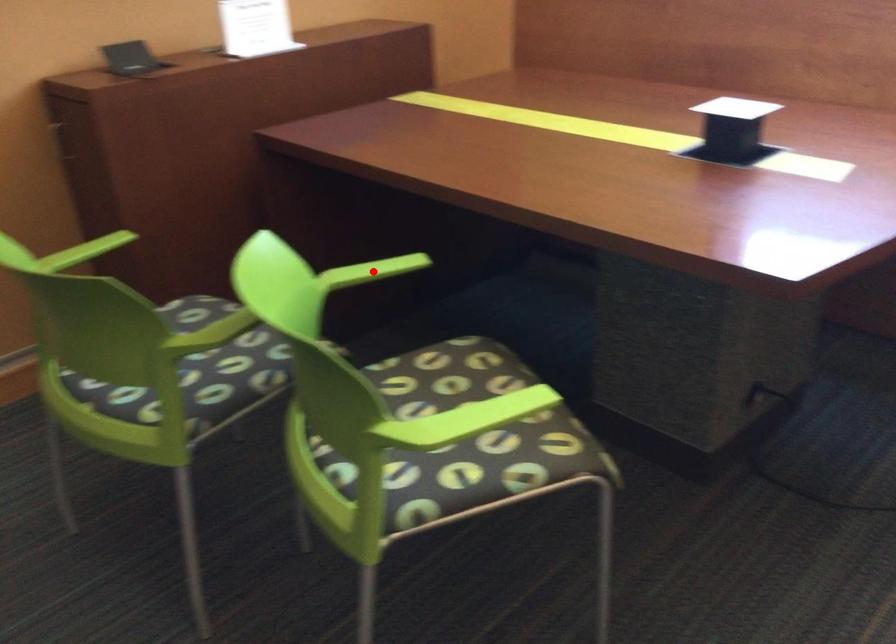
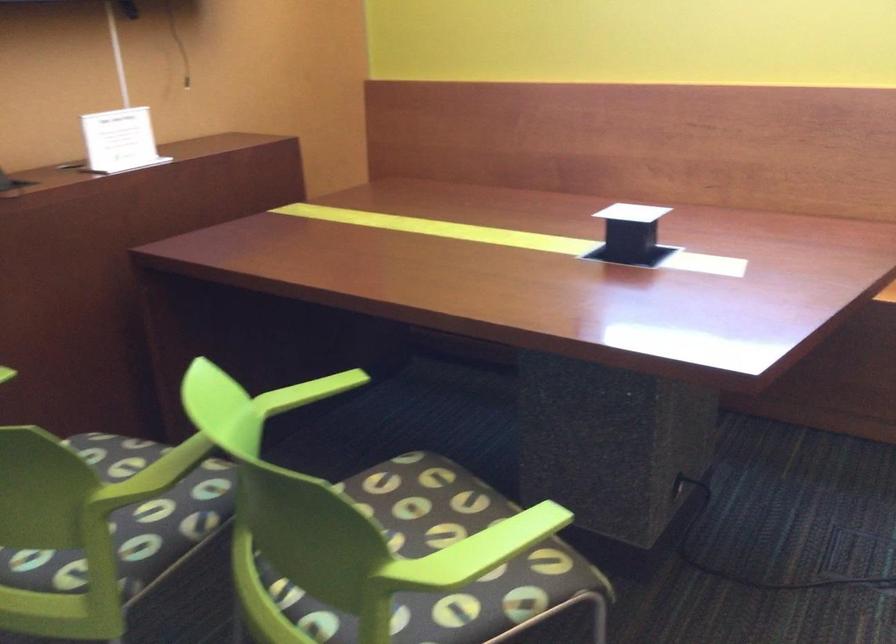
Locate, in the second image, the point that corresponds to the highlighted location in the first image.

(307, 392)